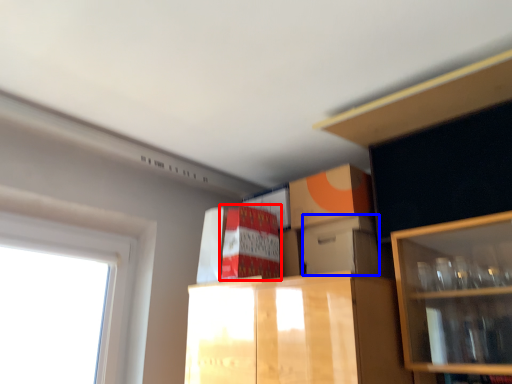
Question: Which object is closer to the camera taking this photo, cabinetry (highlighted by a red box) or storage box (highlighted by a blue box)?

Choices:
 (A) cabinetry
 (B) storage box

Answer: (B)